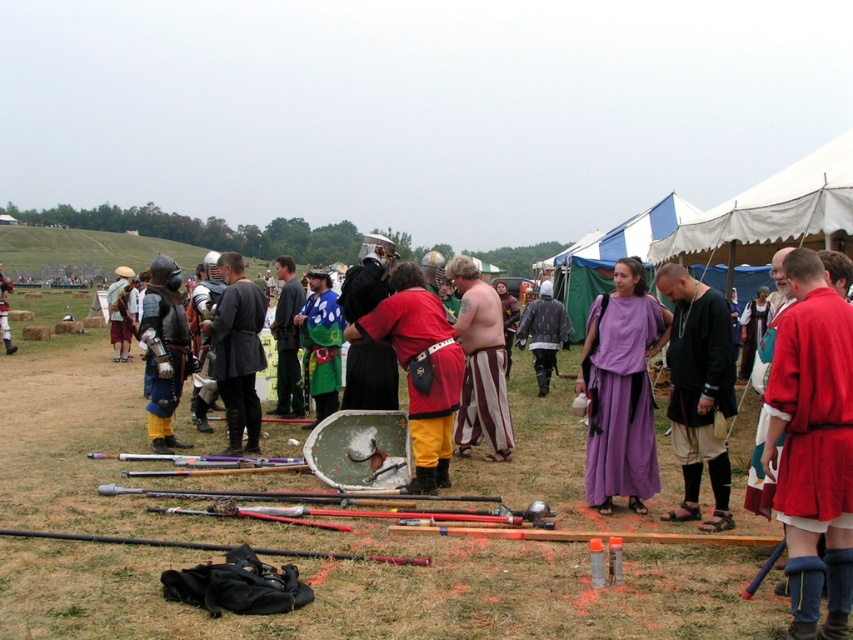
Question: Among these points, which one is nearest to the camera?

Choices:
 (A) (177, 385)
 (B) (410, 346)
 (C) (834, 321)

Answer: (C)

Question: Can you confirm if rubberized red pants at center is positioned to the right of green fabric cape at center?

Choices:
 (A) yes
 (B) no

Answer: (A)

Question: Does striped cotton pants at center appear under matte green fabric at center?

Choices:
 (A) yes
 (B) no

Answer: (B)

Question: Which object is closer to the camera taking this photo?

Choices:
 (A) dark gray leather armor at center
 (B) striped cotton pants at center
 (C) shiny metallic armor at left
 (D) black leather sandals at center

Answer: (D)

Question: Does dark gray leather armor at center have a lesser width compared to shiny metallic armor at left?

Choices:
 (A) no
 (B) yes

Answer: (B)

Question: Based on their relative distances, which object is farther from the green fabric cape at center?

Choices:
 (A) black leather sandals at center
 (B) rubberized red pants at center
 (C) shiny silver armor at center
 (D) matte green fabric at center

Answer: (A)